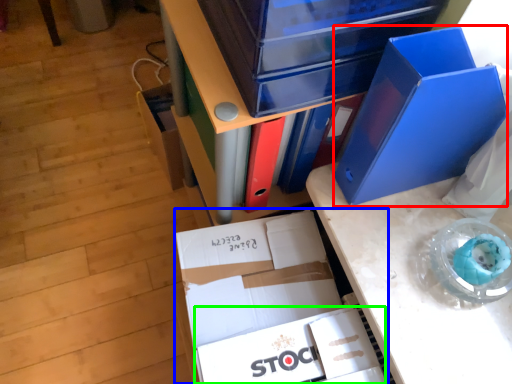
Question: Which object is the closest to the paperback book (highlighted by a red box)? Choose among these: box (highlighted by a blue box) or paperback book (highlighted by a green box).

Choices:
 (A) box
 (B) paperback book

Answer: (A)